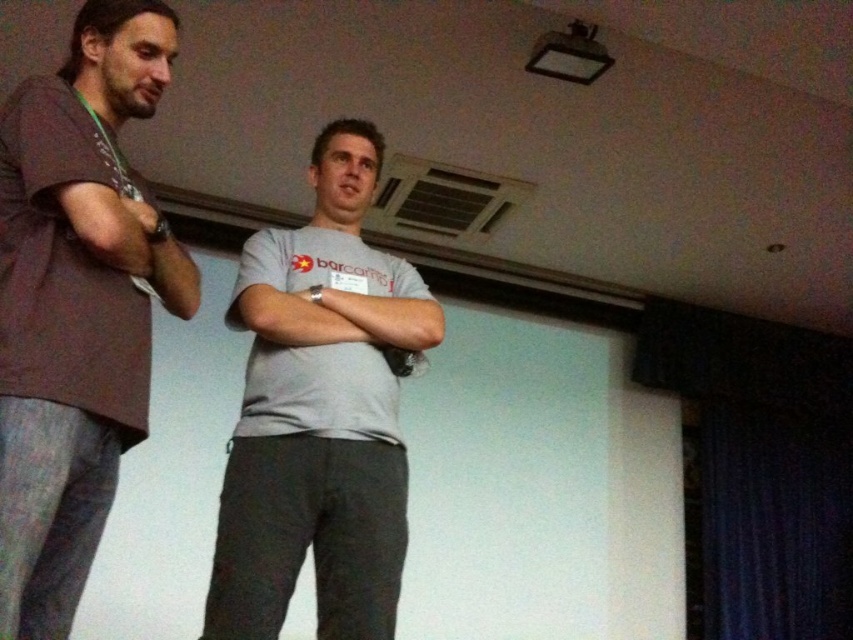
Question: Which object appears closest to the camera in this image?

Choices:
 (A) gray cotton t-shirt at center
 (B) matte brown shirt at left

Answer: (B)

Question: Does matte brown shirt at left appear under gray cotton t-shirt at center?

Choices:
 (A) no
 (B) yes

Answer: (A)

Question: Can you confirm if matte brown shirt at left is wider than gray cotton t-shirt at center?

Choices:
 (A) no
 (B) yes

Answer: (A)

Question: In this image, where is matte brown shirt at left located relative to gray cotton t-shirt at center?

Choices:
 (A) left
 (B) right

Answer: (A)

Question: Which point is closer to the camera?

Choices:
 (A) gray cotton t-shirt at center
 (B) matte brown shirt at left

Answer: (B)